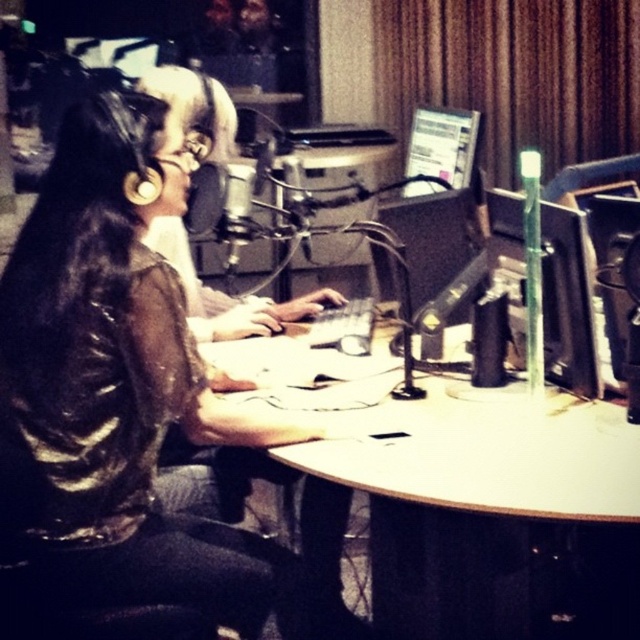
Looking at this image, you are a guest entering the radio studio and want to sit between the matte black shirt at center and the white glossy computer desk at center. Can you comfortably sit between them?

The matte black shirt at center is taller than the white glossy computer desk at center, so there might not be enough space between them for you to sit comfortably.

You are a guest entering the studio and need to sit next to the white glossy computer desk at center. Which side of the desk should you choose to be seated next to the matte black shirt at center?

The matte black shirt at center is positioned on the left side of white glossy computer desk at center, so you should choose the left side of the desk to be seated next to the matte black shirt at center.